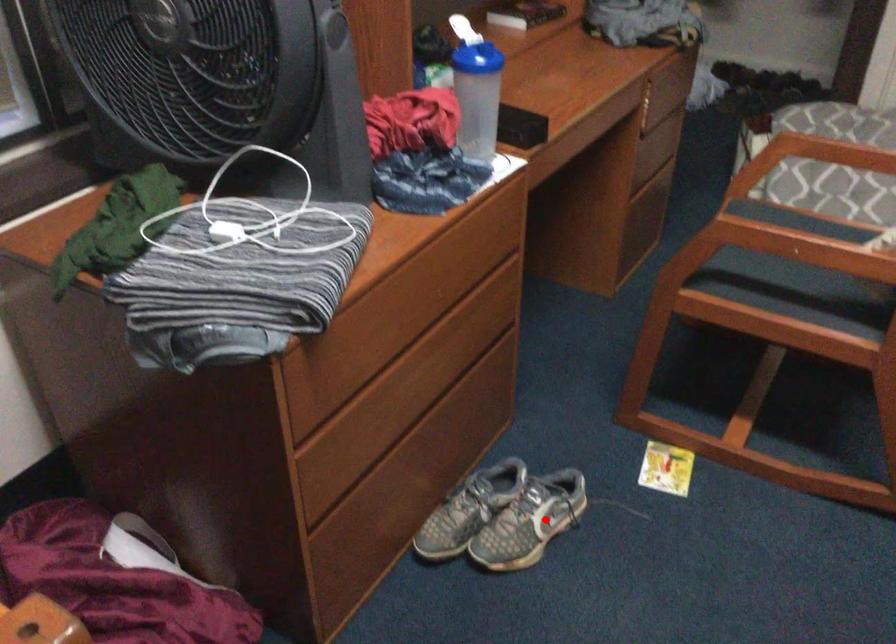
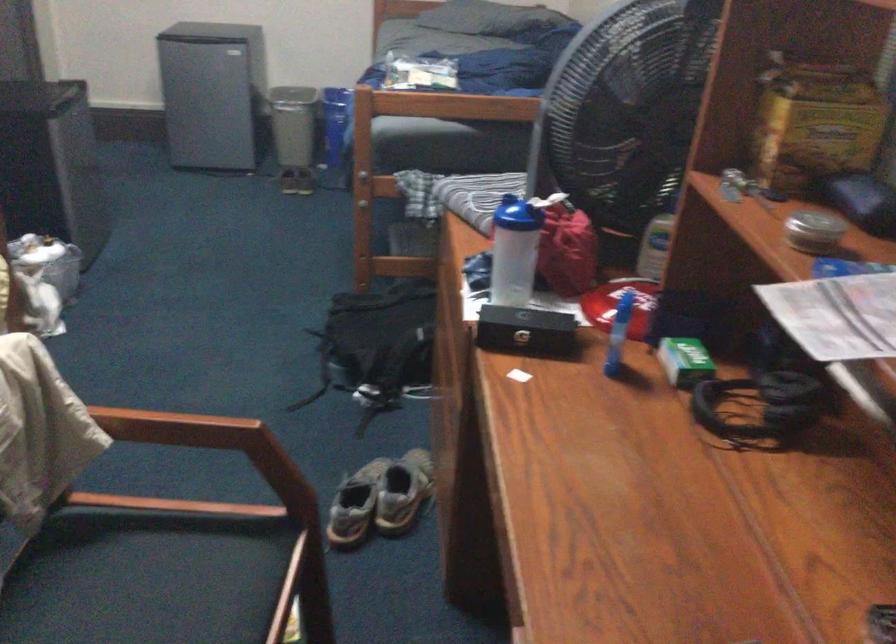
Locate, in the second image, the point that corresponds to the highlighted location in the first image.

(355, 505)